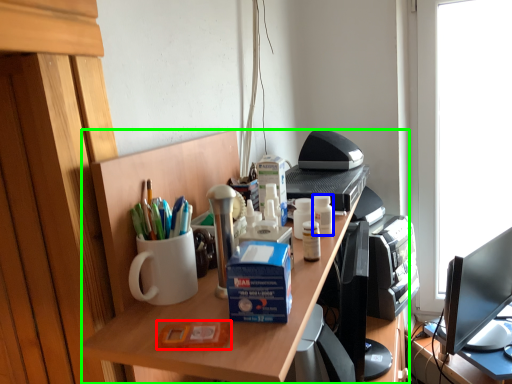
Question: Estimate the real-world distances between objects in this image. Which object is farther from stationery (highlighted by a red box), stationery (highlighted by a blue box) or desk (highlighted by a green box)?

Choices:
 (A) stationery
 (B) desk

Answer: (A)